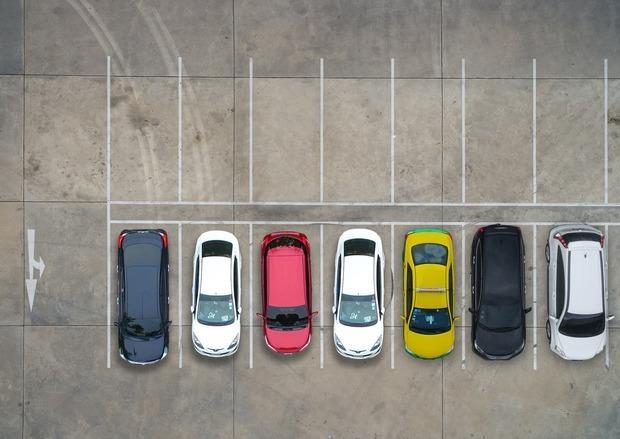
Identify the location of hoods. The width and height of the screenshot is (620, 439). (582, 352), (490, 347), (425, 349), (365, 344), (284, 344), (216, 340), (146, 346).